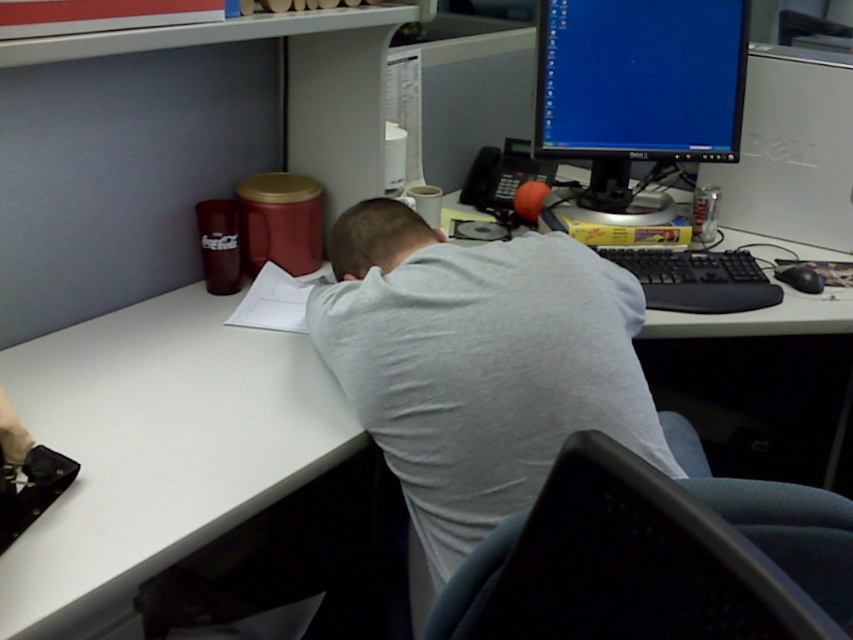
Does white plastic desk at center have a lesser width compared to black glossy monitor at upper right?

Incorrect, white plastic desk at center's width is not less than black glossy monitor at upper right's.

Who is more distant from viewer, (30, 419) or (712, 28)?

The point (712, 28) is more distant.

Image resolution: width=853 pixels, height=640 pixels. In order to click on white plastic desk at center in this screenshot , I will do `click(157, 449)`.

Does white plastic desk at center have a lesser height compared to gray cotton shirt at center?

Indeed, white plastic desk at center has a lesser height compared to gray cotton shirt at center.

Who is more forward, (21, 572) or (630, 381)?

Point (21, 572)

Locate an element on the screen. This screenshot has width=853, height=640. white plastic desk at center is located at coordinates (157, 449).

Which is more to the right, gray cotton shirt at center or black glossy monitor at upper right?

Positioned to the right is black glossy monitor at upper right.

Does gray cotton shirt at center have a smaller size compared to black glossy monitor at upper right?

Incorrect, gray cotton shirt at center is not smaller in size than black glossy monitor at upper right.

Does point (480, 502) come closer to viewer compared to point (691, 51)?

Yes, it is.

Find the location of `gray cotton shirt at center`. gray cotton shirt at center is located at coordinates (479, 364).